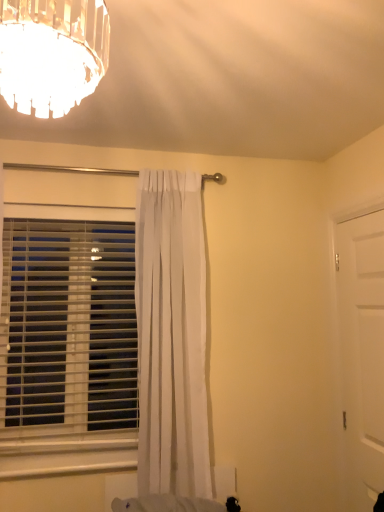
Question: Considering the relative sizes of white matte door at right and white sheer curtain at center in the image provided, is white matte door at right taller than white sheer curtain at center?

Choices:
 (A) no
 (B) yes

Answer: (A)

Question: Can you confirm if white matte door at right is shorter than white sheer curtain at center?

Choices:
 (A) no
 (B) yes

Answer: (B)

Question: Could white sheer curtain at center be considered to be inside white matte door at right?

Choices:
 (A) yes
 (B) no

Answer: (B)

Question: From a real-world perspective, is white matte door at right located higher than white sheer curtain at center?

Choices:
 (A) yes
 (B) no

Answer: (B)

Question: Is white matte door at right smaller than white sheer curtain at center?

Choices:
 (A) yes
 (B) no

Answer: (A)

Question: Considering the positions of point (147, 416) and point (86, 409), is point (147, 416) closer or farther from the camera than point (86, 409)?

Choices:
 (A) farther
 (B) closer

Answer: (B)

Question: From the image's perspective, is white sheer curtain at center positioned above or below white plastic blinds at left?

Choices:
 (A) below
 (B) above

Answer: (B)

Question: Would you say white sheer curtain at center is to the left or to the right of white plastic blinds at left in the picture?

Choices:
 (A) right
 (B) left

Answer: (A)

Question: From a real-world perspective, is white sheer curtain at center physically located above or below white plastic blinds at left?

Choices:
 (A) above
 (B) below

Answer: (A)

Question: Considering the positions of white matte door at right and white plastic blinds at left in the image, is white matte door at right wider or thinner than white plastic blinds at left?

Choices:
 (A) wide
 (B) thin

Answer: (B)

Question: Would you say white matte door at right is to the left or to the right of white plastic blinds at left in the picture?

Choices:
 (A) left
 (B) right

Answer: (B)

Question: Is point [x=362, y=507] positioned closer to the camera than point [x=51, y=318]?

Choices:
 (A) farther
 (B) closer

Answer: (B)

Question: From the image's perspective, is white matte door at right above or below white plastic blinds at left?

Choices:
 (A) below
 (B) above

Answer: (A)

Question: From the image's perspective, is white matte door at right positioned above or below white sheer curtain at center?

Choices:
 (A) above
 (B) below

Answer: (B)

Question: Looking at the image, does white matte door at right seem bigger or smaller compared to white sheer curtain at center?

Choices:
 (A) small
 (B) big

Answer: (A)